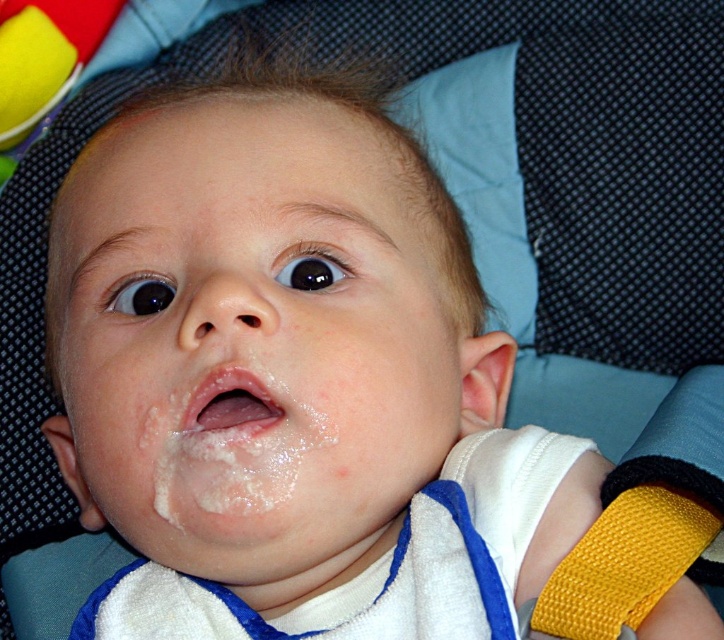
You are a parent trying to reach the yellow fabric strap at lower right to pick up the baby. Based on the coordinates provided, can you estimate if the strap is positioned within the lower half of the image?

The yellow fabric strap at lower right is located at coordinates approximately 0.881 on the x and 0.863 on the y. Since the y coordinate is above 0.5, it is positioned in the upper half of the image, so the strap is not in the lower half.

You are a photographer trying to capture a closeup of the baby in the playpen. You need to focus on the smooth skin baby face at center and the white glossy lips at center. Which of these two features is positioned higher up on the baby?

The smooth skin baby face at center is much taller as white glossy lips at center, so the smooth skin baby face at center is positioned higher up on the baby.